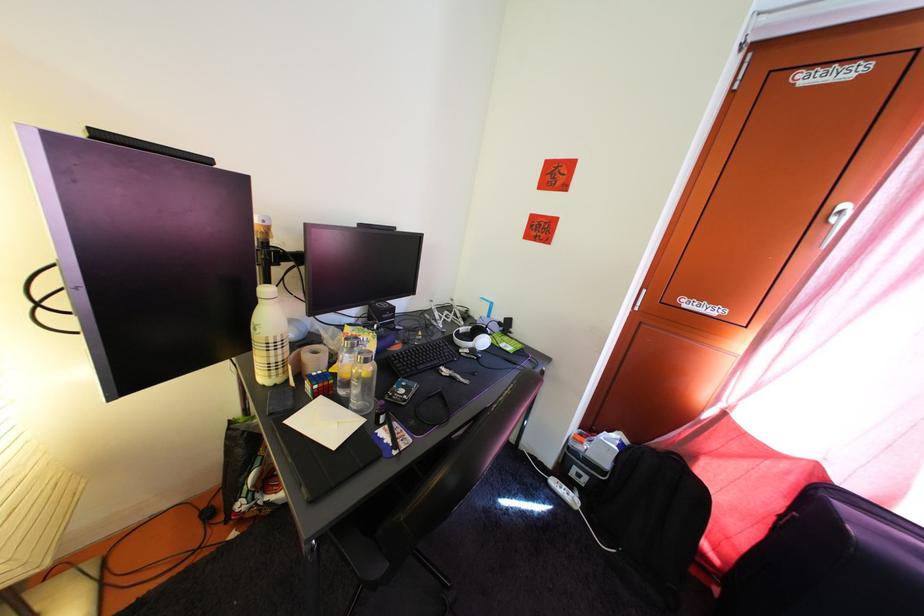
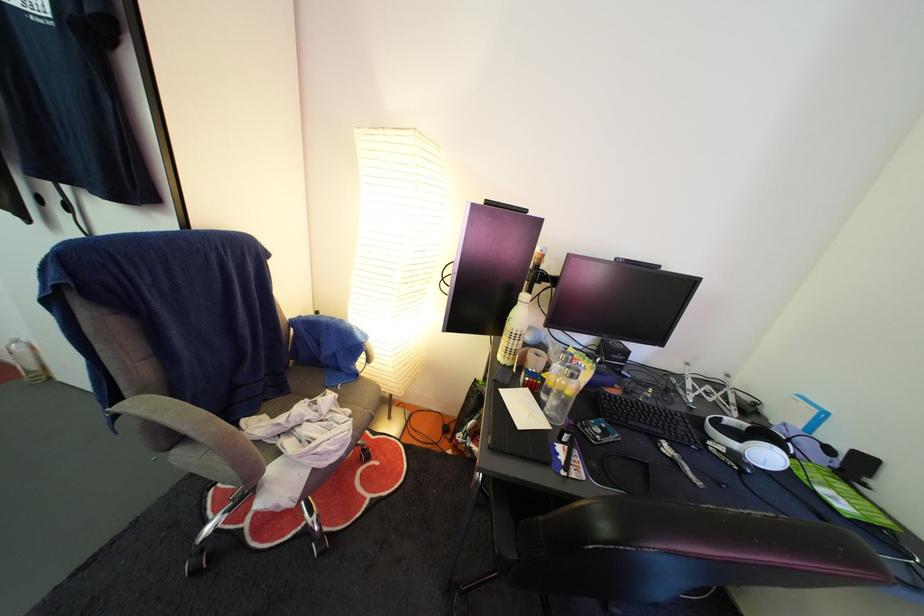
Where in the second image is the point corresponding to point 334,392 from the first image?

(543, 390)